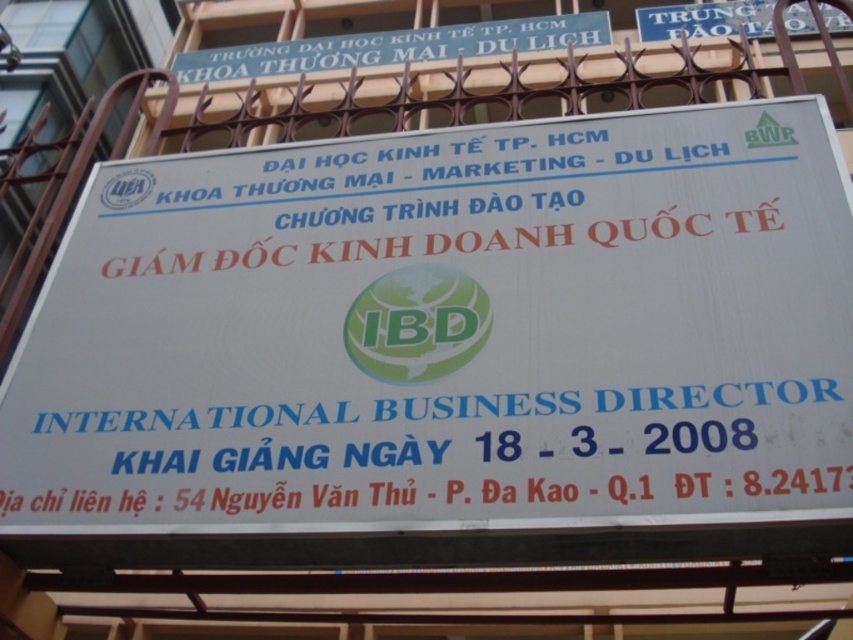
You are standing in front of the signboard and want to touch both the white paper sign at center and the blue plastic signboard at upper center. Which one should you reach for first if you want to touch the one on the left first?

You should reach for the blue plastic signboard at upper center first because it is located to the left of the white paper sign at center.

You are a visitor at the University of Economics, Ho Chi Minh City and you need to find the Department of Commerce, Marketing, Tourism. You see a white paper sign at center and a blue plastic signboard at upper center. According to the information on the signboards, which one is more likely to indicate the correct location of the department?

The blue plastic signboard at upper center is more likely to indicate the correct location because it is positioned above the white paper sign at center, which is typically where main or official signage is placed.